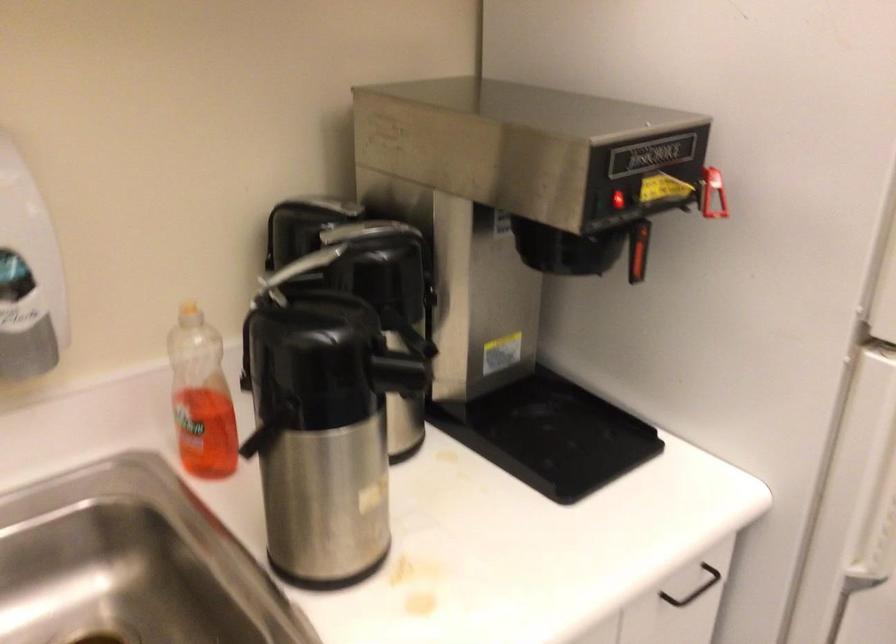
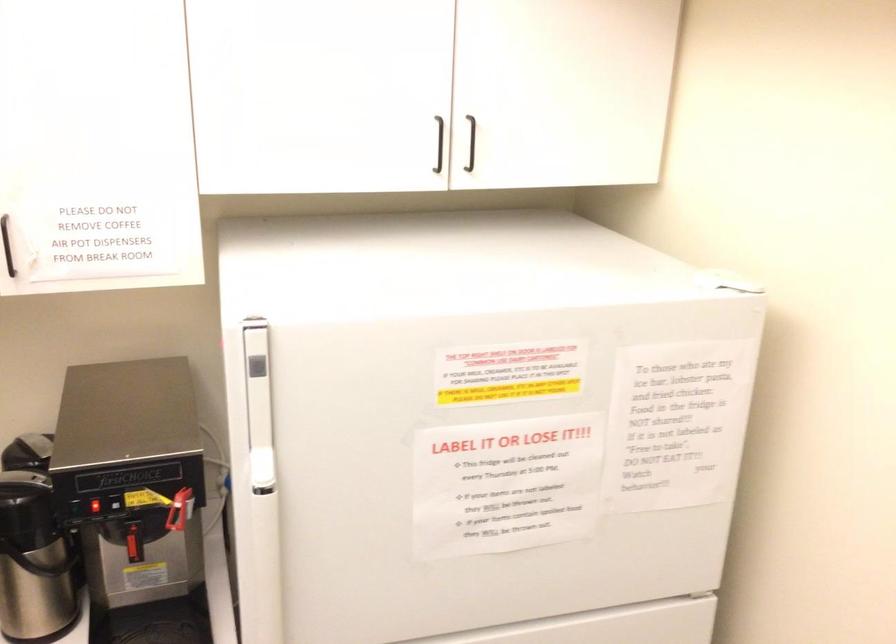
Question: Which direction would the cameraman need to move to produce the second image? Reply with the corresponding letter.

Choices:
 (A) Left
 (B) Right
 (C) Forward
 (D) Backward

Answer: (B)